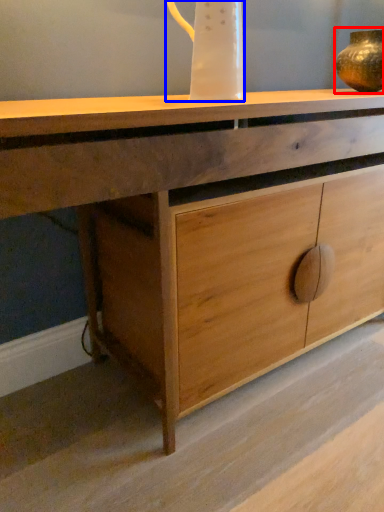
Question: Which of the following is the closest to the observer, candle holder (highlighted by a red box) or jug (highlighted by a blue box)?

Choices:
 (A) candle holder
 (B) jug

Answer: (B)